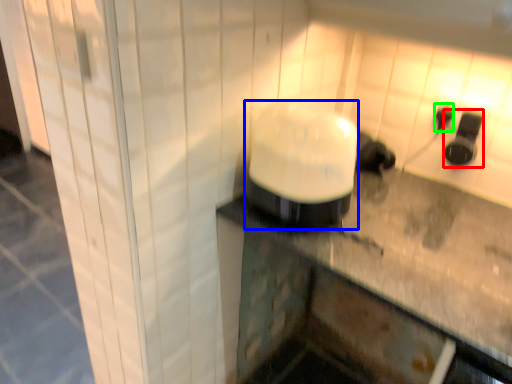
Question: Which object is the closest to the appliance (highlighted by a red box)? Choose among these: appliance (highlighted by a blue box) or electric outlet (highlighted by a green box).

Choices:
 (A) appliance
 (B) electric outlet

Answer: (B)